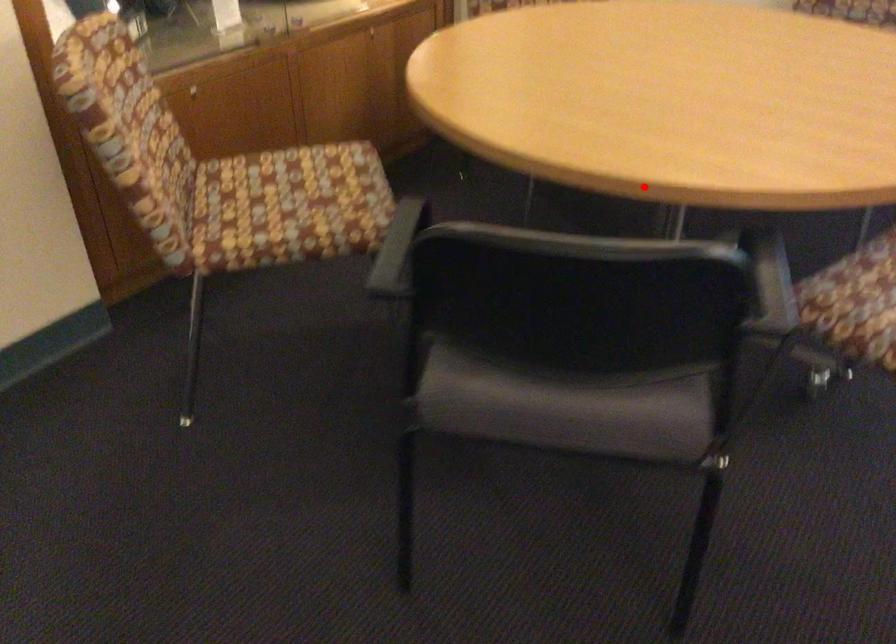
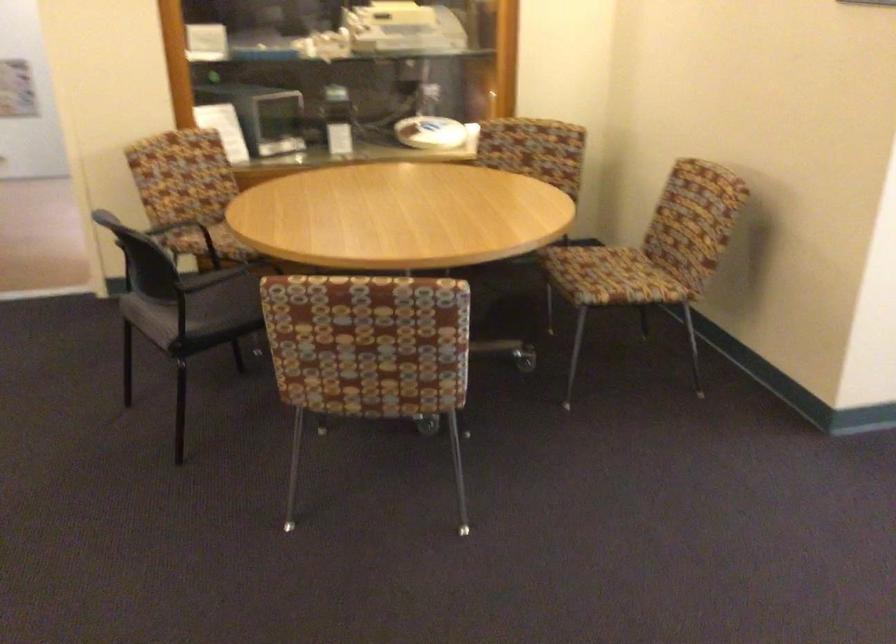
In the second image, find the point that corresponds to the highlighted location in the first image.

(228, 229)